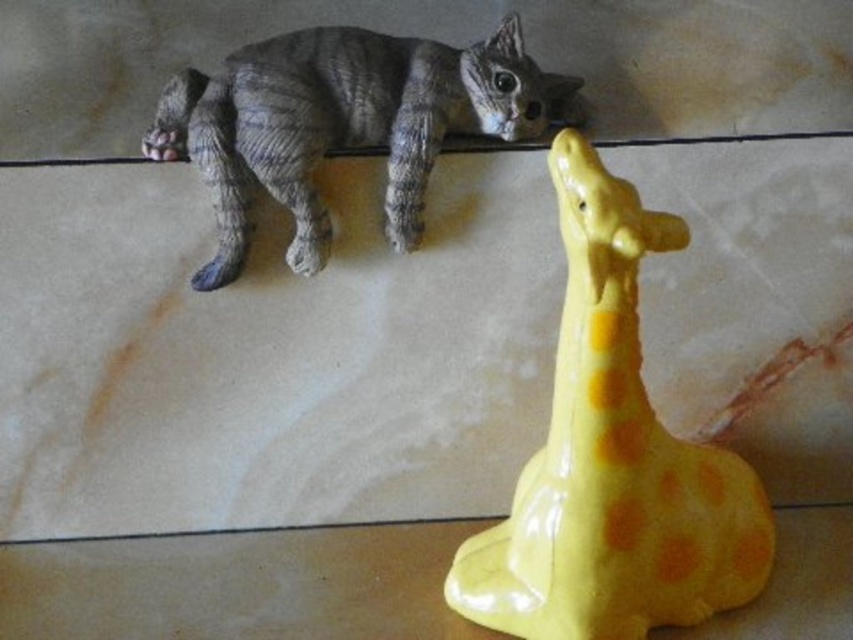
You are standing in front of the tiled surface and want to pick up the closest object. Which one should you choose between the yellow glossy giraffe at lower right and the gray textured cat at upper center?

The yellow glossy giraffe at lower right is closer to the viewer than the gray textured cat at upper center, so you should pick up the yellow glossy giraffe at lower right.

You are a collector of small figurines and want to place them on a shelf. You have two figurines in front of you, the yellow glossy giraffe at lower right and the gray textured cat at upper center. Which one do you think will take up more space on the shelf?

The yellow glossy giraffe at lower right is larger in size than the gray textured cat at upper center, so it will take up more space on the shelf.

Looking at this image, you are standing at the center of the tiled surface and want to place a new object exactly between the cat figurine and the yellow glossy giraffe at lower right. What are the coordinates where you should place the new object?

The coordinates to place the new object between the cat figurine and the yellow glossy giraffe at lower right would be the midpoint between their positions. Since the giraffe is at point [612,460], and the cat is at an unknown position, we need more information to determine the exact coordinates. However, if the cat is on the left side, it might be around point [612,179]. The midpoint would then be approximately [612,320].